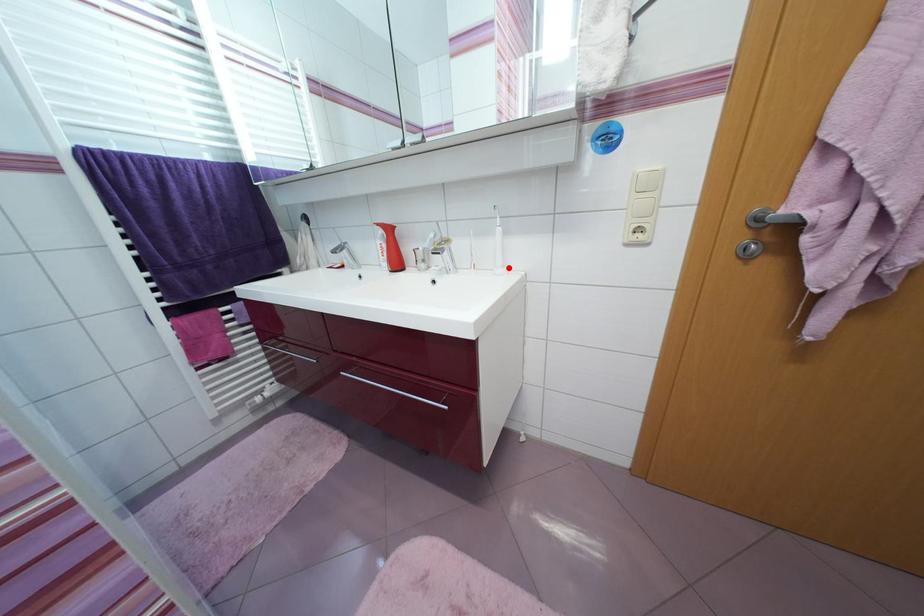
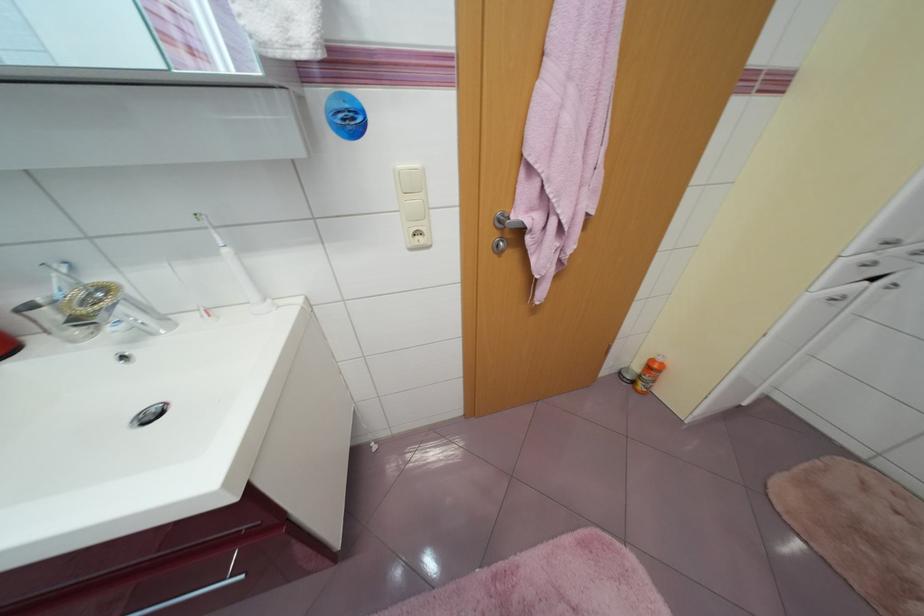
Where in the second image is the point corresponding to the highlighted location from the first image?

(270, 302)